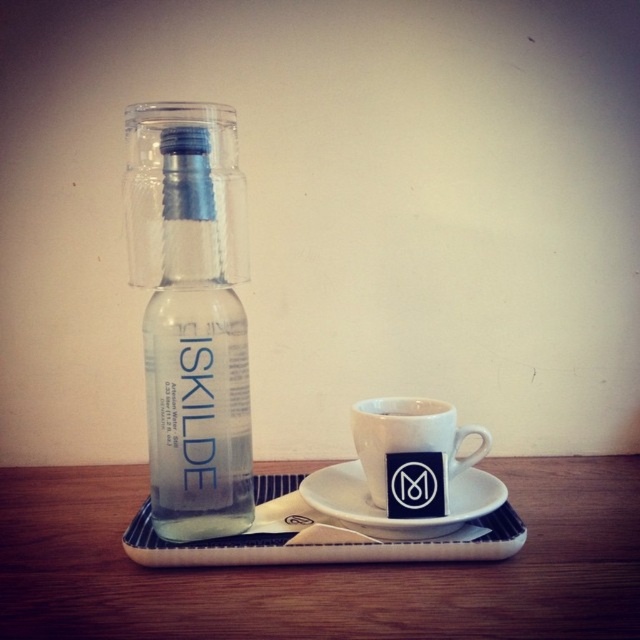
You are setting up a table for a small gathering and have the clear glass bottle at left and the white ceramic mug at lower center. If you want to pour the contents of the bottle into the mug, will you need to move either object? Explain why.

The clear glass bottle at left is positioned over the white ceramic mug at lower center, so you would need to move the bottle or the mug to pour the contents into the mug since they are currently overlapping.

You have a small toy car that is 10 cm long. You want to place it on the wooden surface next to the clear glass bottle at left and the white ceramic saucer at center. Can the toy car fit entirely on the surface without overlapping either object?

The clear glass bottle at left is narrower than the white ceramic saucer at center. Since the toy car is 10 cm long, it can be placed between them or on either side as long as there is enough space. However, the exact placement depends on the distance between the two objects, which isn

You are standing in front of the wooden surface and want to place a new object at point [410,436]. Is there already an object at that location?

Yes, there is a white ceramic mug at lower center at point [410,436].